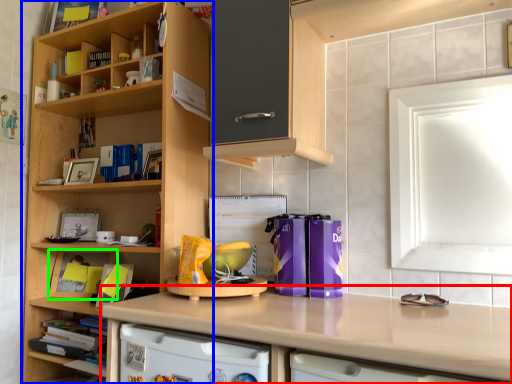
Question: Estimate the real-world distances between objects in this image. Which object is closer to countertop (highlighted by a red box), cupboard (highlighted by a blue box) or cabinet (highlighted by a green box)?

Choices:
 (A) cupboard
 (B) cabinet

Answer: (A)